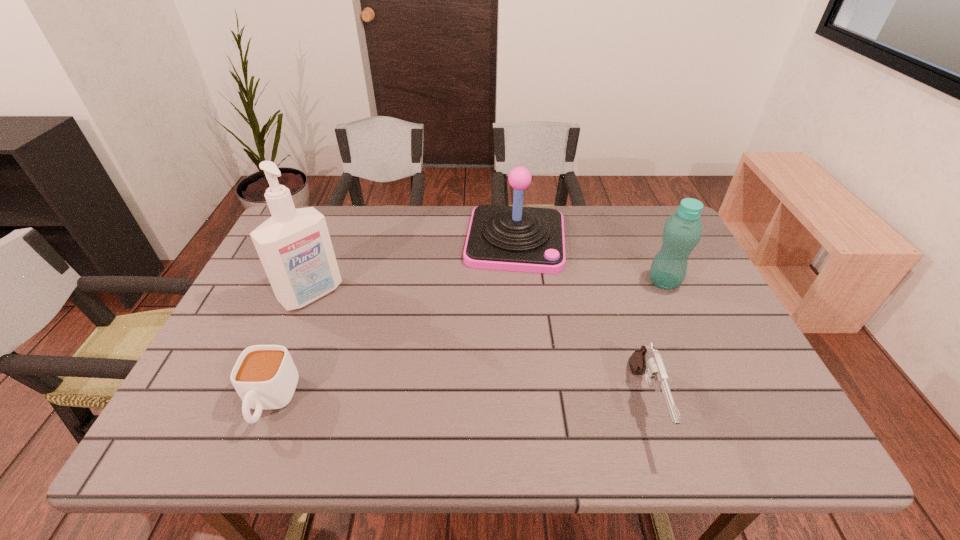
The height and width of the screenshot is (540, 960). I want to click on vacant space located at the front cap of the rightmost object, so click(x=589, y=327).

Identify the location of vacant space located at the front cap of the rightmost object. (604, 318).

The width and height of the screenshot is (960, 540). I want to click on vacant space located 0.170m forward from the base of the joystick, so click(509, 319).

Locate an element on the screen. vacant point located 0.180m forward from the base of the joystick is located at coordinates [x=509, y=321].

I want to click on vacant region located 0.250m forward from the base of the joystick, so click(507, 343).

Identify the location of object present at the far edge. This screenshot has width=960, height=540. (511, 238).

At what (x,y) coordinates should I click in order to perform the action: click on cup located in the near edge section of the desktop. Please return your answer as a coordinate pair (x, y). The height and width of the screenshot is (540, 960). Looking at the image, I should click on (265, 377).

This screenshot has height=540, width=960. Identify the location of gun located at the near edge. (647, 360).

Locate an element on the screen. cup present at the left edge is located at coordinates (265, 377).

Image resolution: width=960 pixels, height=540 pixels. Identify the location of cleansing agent present at the left edge. (294, 245).